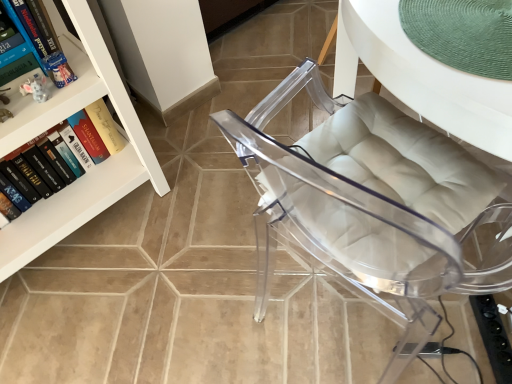
Question: Is white glossy bookcase at upper left in front of transparent acrylic chair at center?

Choices:
 (A) yes
 (B) no

Answer: (B)

Question: Is white glossy bookcase at upper left turned away from transparent acrylic chair at center?

Choices:
 (A) yes
 (B) no

Answer: (B)

Question: Is white glossy bookcase at upper left directly adjacent to transparent acrylic chair at center?

Choices:
 (A) yes
 (B) no

Answer: (B)

Question: Can you confirm if white glossy bookcase at upper left is thinner than transparent acrylic chair at center?

Choices:
 (A) yes
 (B) no

Answer: (A)

Question: Can you confirm if white glossy bookcase at upper left is taller than transparent acrylic chair at center?

Choices:
 (A) no
 (B) yes

Answer: (B)

Question: Does white glossy bookcase at upper left contain transparent acrylic chair at center?

Choices:
 (A) yes
 (B) no

Answer: (B)

Question: Is green woven placemat at upper right completely or partially inside white glossy bookcase at upper left?

Choices:
 (A) yes
 (B) no

Answer: (B)

Question: Does white glossy bookcase at upper left have a lesser height compared to green woven placemat at upper right?

Choices:
 (A) no
 (B) yes

Answer: (A)

Question: Is white glossy bookcase at upper left wider than green woven placemat at upper right?

Choices:
 (A) no
 (B) yes

Answer: (A)

Question: From a real-world perspective, does white glossy bookcase at upper left stand above green woven placemat at upper right?

Choices:
 (A) yes
 (B) no

Answer: (B)

Question: From a real-world perspective, is white glossy bookcase at upper left under green woven placemat at upper right?

Choices:
 (A) no
 (B) yes

Answer: (B)

Question: Is white glossy bookcase at upper left taller than green woven placemat at upper right?

Choices:
 (A) yes
 (B) no

Answer: (A)

Question: Is transparent acrylic chair at center closer to camera compared to hardcover book at upper left, arranged as the 2th book when ordered from the bottom?

Choices:
 (A) yes
 (B) no

Answer: (A)